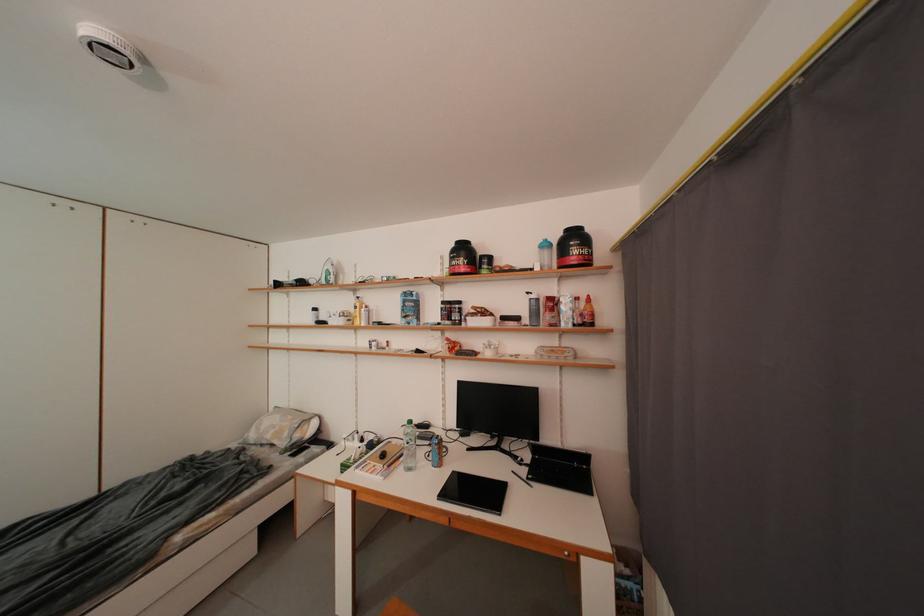
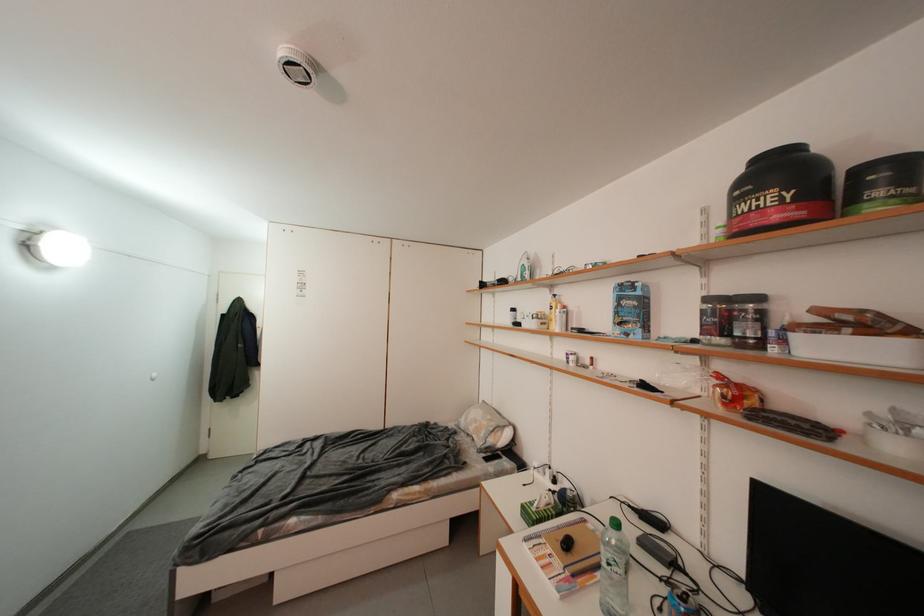
Find the pixel in the second image that matches (x=468, y=265) in the first image.

(776, 201)